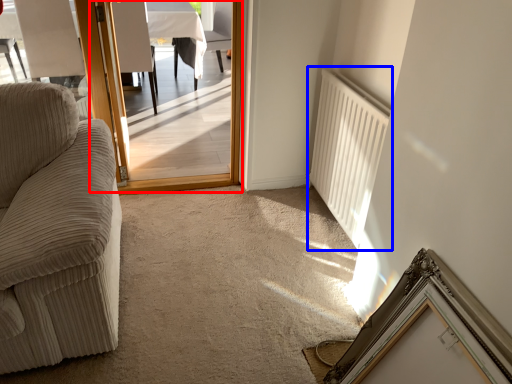
Question: Which object is closer to the camera taking this photo, screen door (highlighted by a red box) or radiator (highlighted by a blue box)?

Choices:
 (A) screen door
 (B) radiator

Answer: (B)